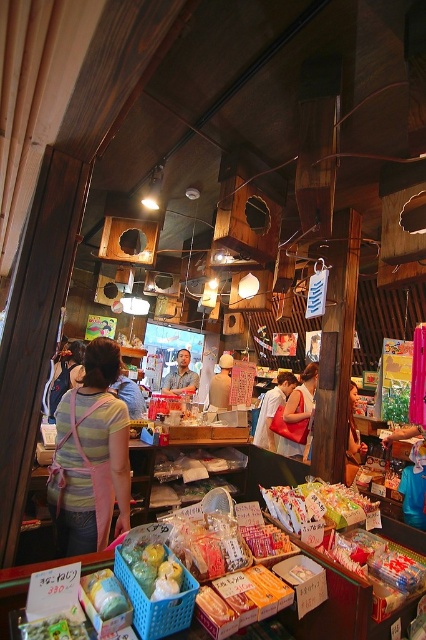
You are a customer in the shop and want to pick up both the translucent plastic bag at center and the matte red handbag at center. Can you reach both items without moving your position?

The distance between the translucent plastic bag at center and the matte red handbag at center is 2.89 meters. Since the items are more than 2 meters apart, you cannot reach both items without moving your position.

From the picture: You are a customer in the shop and want to pick up both the pink fabric apron at center and the matte red bag at center. Which item is easier to reach without moving your current position?

The pink fabric apron at center is closer to the viewer than the matte red bag at center, so it is easier to reach without moving.